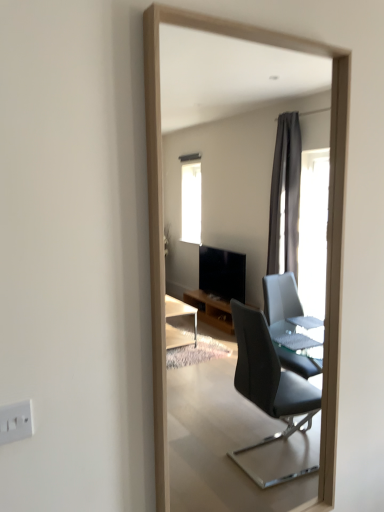
Image resolution: width=384 pixels, height=512 pixels. In order to click on free space above wooden frame at center (from a real-world perspective) in this screenshot , I will do `click(255, 27)`.